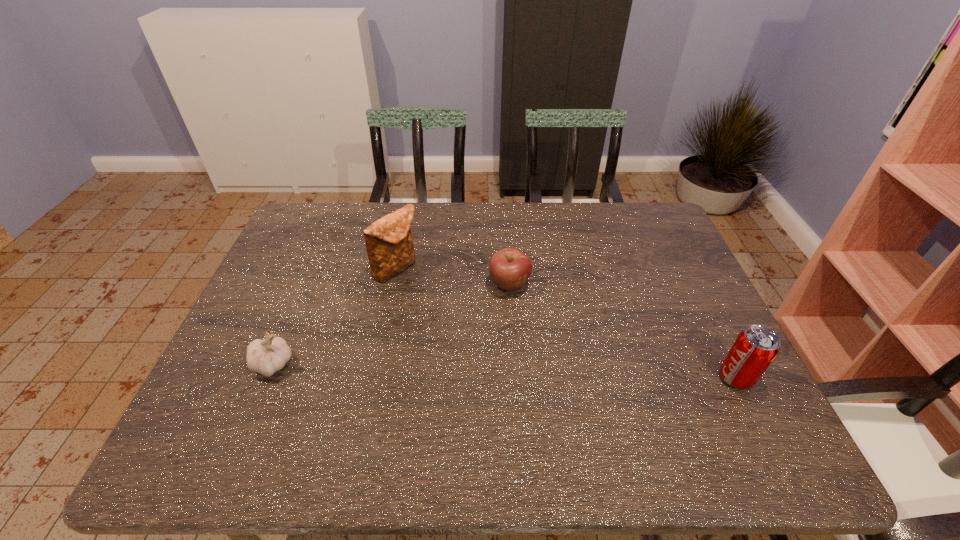
Image resolution: width=960 pixels, height=540 pixels. What are the coordinates of `the third tallest object` in the screenshot? It's located at (267, 356).

The image size is (960, 540). In order to click on garlic in this screenshot , I will do [x=267, y=356].

This screenshot has width=960, height=540. What are the coordinates of `the rightmost object` in the screenshot? It's located at (754, 349).

At what (x,y) coordinates should I click in order to perform the action: click on soda can. Please return your answer as a coordinate pair (x, y). The width and height of the screenshot is (960, 540). Looking at the image, I should click on (754, 349).

The width and height of the screenshot is (960, 540). I want to click on the shortest object, so click(x=509, y=268).

Where is `apple`? apple is located at coordinates (509, 268).

The width and height of the screenshot is (960, 540). I want to click on the third object from right to left, so click(x=390, y=249).

The width and height of the screenshot is (960, 540). In order to click on clutch bag in this screenshot , I will do `click(390, 249)`.

You are a GUI agent. You are given a task and a screenshot of the screen. Output one action in this format:
    pyautogui.click(x=<x>, y=<y>)
    Task: Click on the vacant space positioned on the right of the leftmost object
    Image resolution: width=960 pixels, height=540 pixels.
    Given the screenshot: What is the action you would take?
    pyautogui.click(x=439, y=364)

You are a GUI agent. You are given a task and a screenshot of the screen. Output one action in this format:
    pyautogui.click(x=<x>, y=<y>)
    Task: Click on the free space located 0.190m on the back of the rightmost object
    
    Given the screenshot: What is the action you would take?
    pyautogui.click(x=700, y=306)